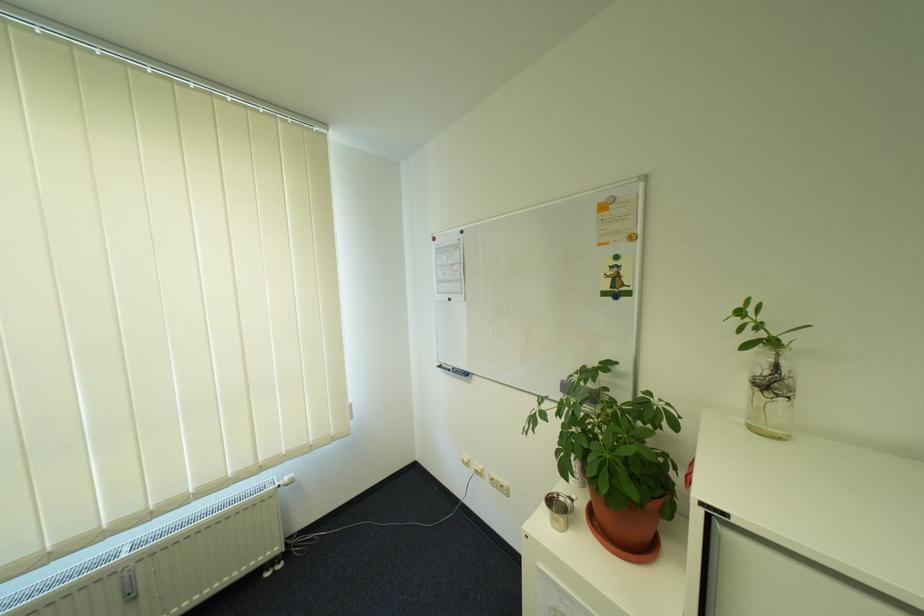
Which object does [614,294] point to?

This point indicates the blue round magnet.